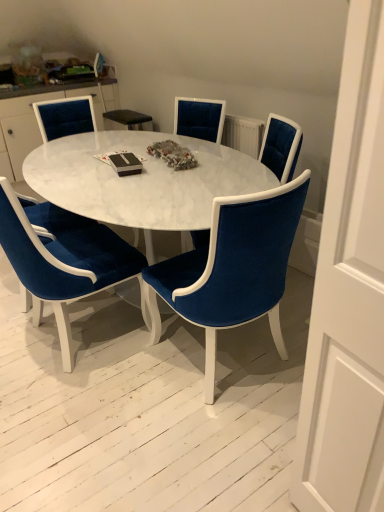
Question: Does velvet blue chair at center, the second chair in the right-to-left sequence, lie in front of velvet blue armchair at lower left?

Choices:
 (A) yes
 (B) no

Answer: (A)

Question: Is velvet blue chair at center, which is the fourth chair in left-to-right order, placed right next to velvet blue armchair at lower left?

Choices:
 (A) no
 (B) yes

Answer: (A)

Question: Would you say velvet blue chair at center, the second chair in the right-to-left sequence, contains velvet blue armchair at lower left?

Choices:
 (A) no
 (B) yes

Answer: (A)

Question: From the image's perspective, does velvet blue chair at center, the second chair in the right-to-left sequence, appear lower than velvet blue armchair at lower left?

Choices:
 (A) no
 (B) yes

Answer: (B)

Question: Does velvet blue chair at center, the second chair in the right-to-left sequence, turn towards velvet blue armchair at lower left?

Choices:
 (A) no
 (B) yes

Answer: (B)

Question: Considering the relative sizes of velvet blue chair at center, the second chair in the right-to-left sequence, and velvet blue armchair at lower left in the image provided, is velvet blue chair at center, the second chair in the right-to-left sequence, smaller than velvet blue armchair at lower left?

Choices:
 (A) yes
 (B) no

Answer: (B)

Question: Are white marble coffee table at center and velvet blue chair at upper left, which is counted as the 5th chair, starting from the right, beside each other?

Choices:
 (A) no
 (B) yes

Answer: (A)

Question: Considering the relative sizes of white marble coffee table at center and velvet blue chair at upper left, which is counted as the 5th chair, starting from the right, in the image provided, is white marble coffee table at center smaller than velvet blue chair at upper left, which is counted as the 5th chair, starting from the right,?

Choices:
 (A) yes
 (B) no

Answer: (B)

Question: Is white marble coffee table at center shorter than velvet blue chair at upper left, which appears as the 1th chair when viewed from the left?

Choices:
 (A) no
 (B) yes

Answer: (B)

Question: Is white marble coffee table at center wider than velvet blue chair at upper left, which is counted as the 5th chair, starting from the right?

Choices:
 (A) yes
 (B) no

Answer: (A)

Question: Is white marble coffee table at center to the left of velvet blue chair at upper left, which appears as the 1th chair when viewed from the left, from the viewer's perspective?

Choices:
 (A) no
 (B) yes

Answer: (A)

Question: From a real-world perspective, is white marble coffee table at center physically above velvet blue chair at upper left, which appears as the 1th chair when viewed from the left?

Choices:
 (A) yes
 (B) no

Answer: (B)

Question: Does velvet blue chair at center, which is the fourth chair in left-to-right order, contain velvet blue chair at center, which appears as the 2th chair when viewed from the left?

Choices:
 (A) no
 (B) yes

Answer: (A)